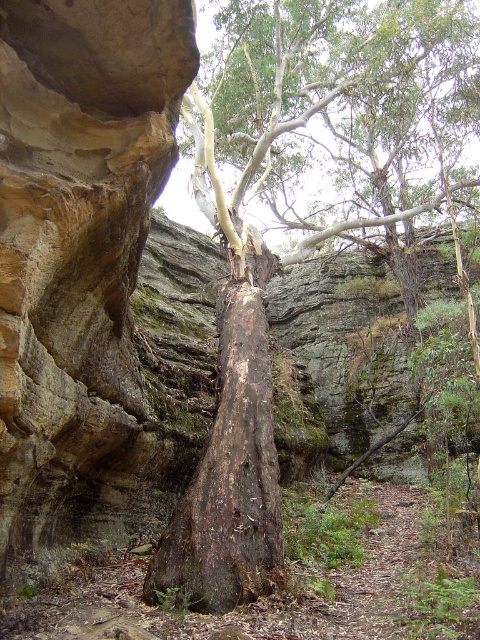
You are standing at the point labeled as point (x=235, y=408). Based on the scene described, what object are you directly facing?

The point (x=235, y=408) indicates dark brown bark tree at center, so you are directly facing the dark brown bark tree at center.

You are standing at the point with coordinates point (200, 506) and want to walk towards the point with coordinates point (301, 257). Which direction should you move relative to the large tree trunk in the scene?

Since point (301, 257) is behind point (200, 506) relative to the large tree trunk, you should move in the direction away from the large tree trunk to reach point (301, 257) from point (200, 506).